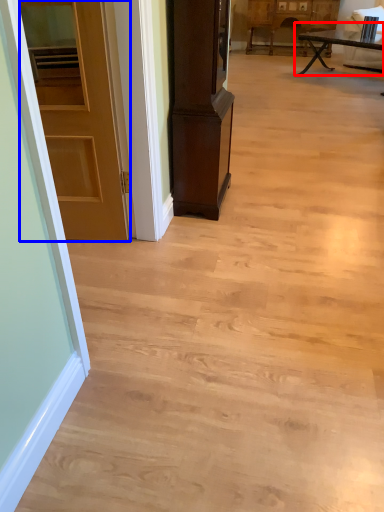
Question: Which object appears farthest to the camera in this image, table (highlighted by a red box) or door (highlighted by a blue box)?

Choices:
 (A) table
 (B) door

Answer: (A)